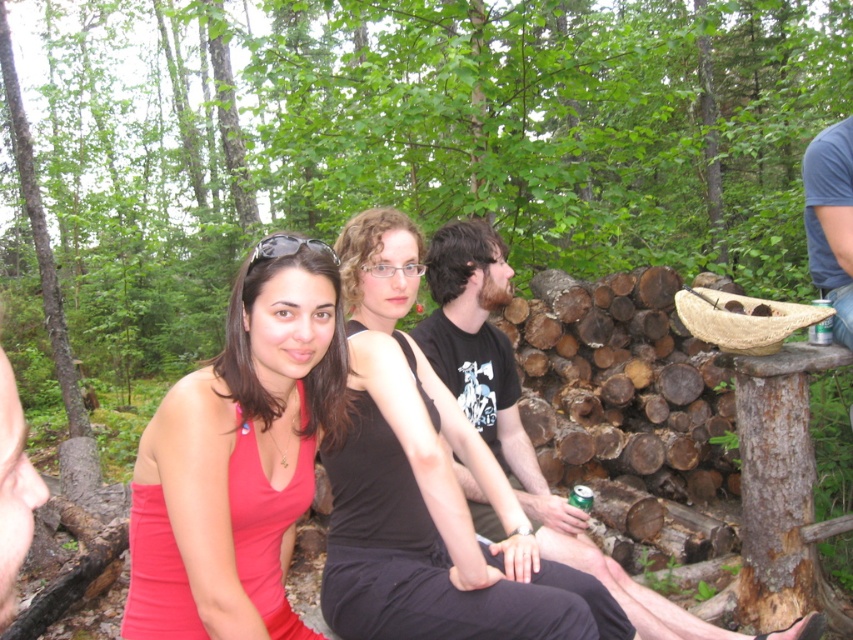
You are standing in the forest scene and want to place a small flag at the closest point between point (270, 621) and point (463, 224). Which point should you place the flag at?

The point closer to the viewer is point (270, 621), so you should place the flag there.

Looking at this image, you are a photographer trying to capture a closeup of the matte red tank top at center and the black matte tank top at center. Which one should you focus on first if you want to start with the one closer to the camera?

The matte red tank top at center is below the black matte tank top at center, so you should focus on the black matte tank top at center first since it is closer to the camera.